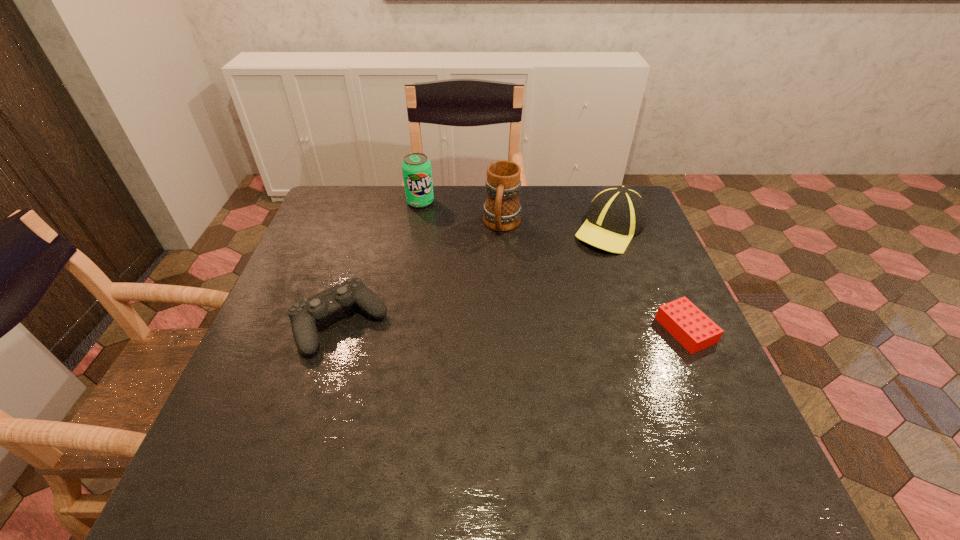
You are a GUI agent. You are given a task and a screenshot of the screen. Output one action in this format:
    pyautogui.click(x=<x>, y=<y>)
    Task: Click on the vacant area situated on the front-facing side of the pop soda
    
    Given the screenshot: What is the action you would take?
    455,250

Locate an element on the screen. The width and height of the screenshot is (960, 540). free space located on the front-facing side of the pop soda is located at coordinates (454, 248).

Image resolution: width=960 pixels, height=540 pixels. What are the coordinates of `vacant region located 0.090m on the front-facing side of the pop soda` in the screenshot? It's located at pyautogui.click(x=436, y=224).

Locate an element on the screen. This screenshot has width=960, height=540. free space located 0.180m on the side of the mug with the handle is located at coordinates (490, 284).

You are a GUI agent. You are given a task and a screenshot of the screen. Output one action in this format:
    pyautogui.click(x=<x>, y=<y>)
    Task: Click on the free region located 0.130m on the side of the mug with the handle
    The image size is (960, 540).
    Given the screenshot: What is the action you would take?
    pos(492,272)

Where is `vacant region located 0.390m on the side of the mug with the handle`? Image resolution: width=960 pixels, height=540 pixels. vacant region located 0.390m on the side of the mug with the handle is located at coordinates (475, 347).

Locate an element on the screen. This screenshot has width=960, height=540. baseball cap that is at the far edge is located at coordinates (616, 214).

Locate an element on the screen. The image size is (960, 540). pop soda located in the far edge section of the desktop is located at coordinates (416, 168).

The width and height of the screenshot is (960, 540). Find the location of `mug present at the far edge`. mug present at the far edge is located at coordinates (502, 211).

Find the location of a particular element. The image size is (960, 540). object that is at the left edge is located at coordinates (304, 315).